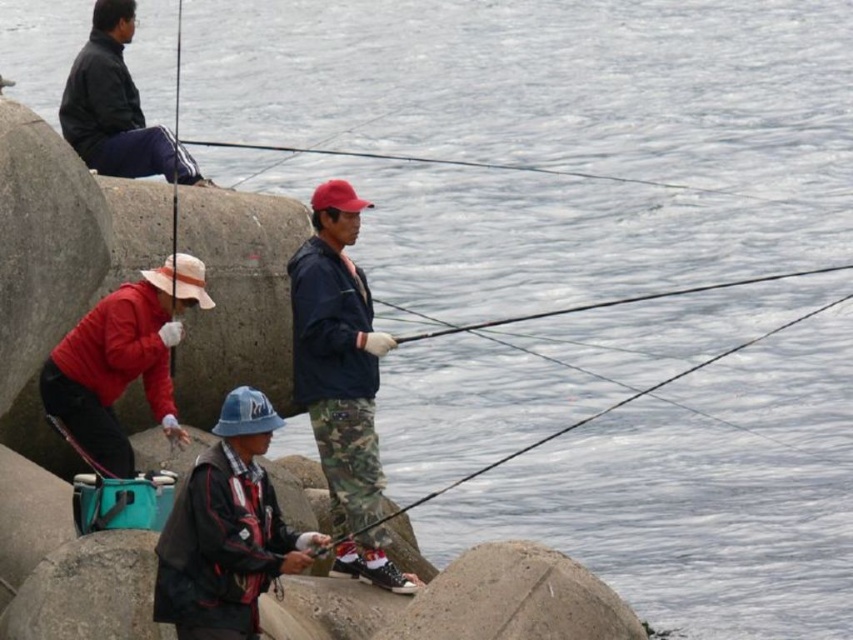
Question: Does camouflage fishing pole at center lie behind matte black fishing pole at upper left?

Choices:
 (A) yes
 (B) no

Answer: (B)

Question: Among these points, which one is nearest to the camera?

Choices:
 (A) (347, 499)
 (B) (329, 525)
 (C) (561, 310)
 (D) (67, 104)

Answer: (A)

Question: Can you confirm if matte black jacket at center is bigger than matte black jacket at upper left?

Choices:
 (A) yes
 (B) no

Answer: (B)

Question: Among these objects, which one is farthest from the camera?

Choices:
 (A) matte red jacket at lower left
 (B) matte black jacket at center
 (C) smooth black rod at center

Answer: (A)

Question: Based on their relative distances, which object is farther from the matte black jacket at upper left?

Choices:
 (A) camouflage pants at center
 (B) matte red jacket at lower left
 (C) camouflage fishing pole at center

Answer: (C)

Question: Can you confirm if camouflage pants at center is wider than matte red jacket at lower left?

Choices:
 (A) no
 (B) yes

Answer: (B)